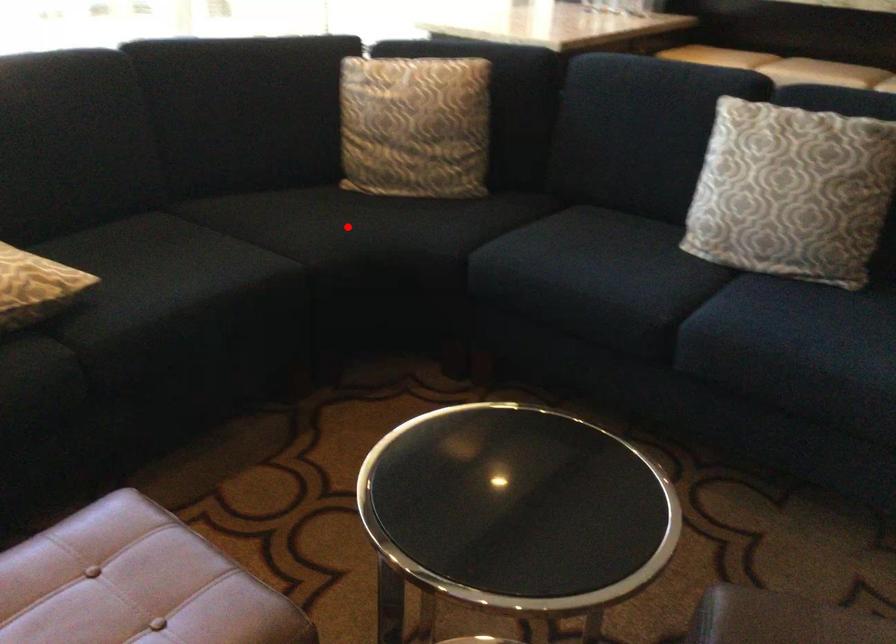
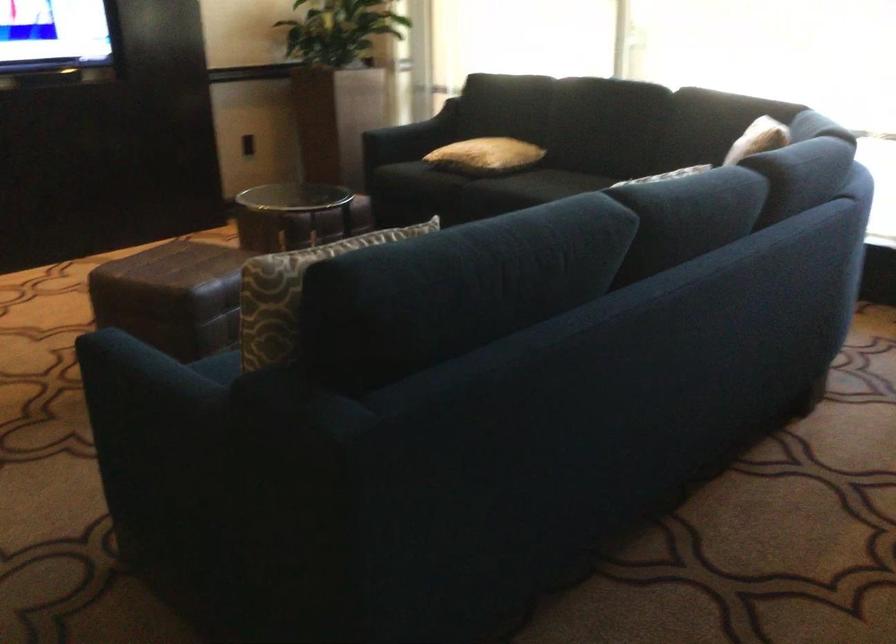
Question: I am providing you with two images of the same scene from different viewpoints. A red point is marked on the first image. Is the red point's position out of view in image 2?

Choices:
 (A) Yes
 (B) No

Answer: (A)